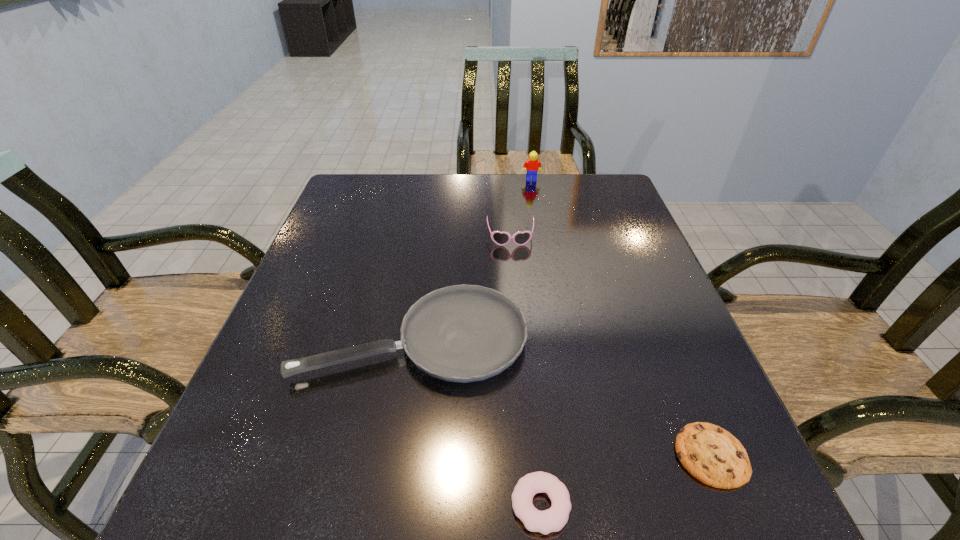
Image resolution: width=960 pixels, height=540 pixels. Find the location of `vacant point located on the front of the third shortest object`. vacant point located on the front of the third shortest object is located at coordinates (401, 421).

In order to click on free location located 0.210m on the left of the fourth tallest object in this screenshot , I will do `click(366, 505)`.

You are a GUI agent. You are given a task and a screenshot of the screen. Output one action in this format:
    pyautogui.click(x=<x>, y=<y>)
    Task: Click on the vacant position located 0.170m on the left of the cookie
    
    Given the screenshot: What is the action you would take?
    pyautogui.click(x=567, y=455)

Locate an element on the screen. This screenshot has height=540, width=960. object that is at the far edge is located at coordinates [x=532, y=164].

I want to click on doughnut that is at the near edge, so click(553, 519).

This screenshot has height=540, width=960. I want to click on cookie situated at the near edge, so click(711, 454).

What are the coordinates of `object at the left edge` in the screenshot? It's located at (463, 333).

You are a GUI agent. You are given a task and a screenshot of the screen. Output one action in this format:
    pyautogui.click(x=<x>, y=<y>)
    Task: Click on the object at the right edge
    This screenshot has height=540, width=960.
    Given the screenshot: What is the action you would take?
    pyautogui.click(x=711, y=454)

Locate an element on the screen. object located in the near right corner section of the desktop is located at coordinates (711, 454).

The image size is (960, 540). I want to click on blank space at the far edge, so (x=492, y=214).